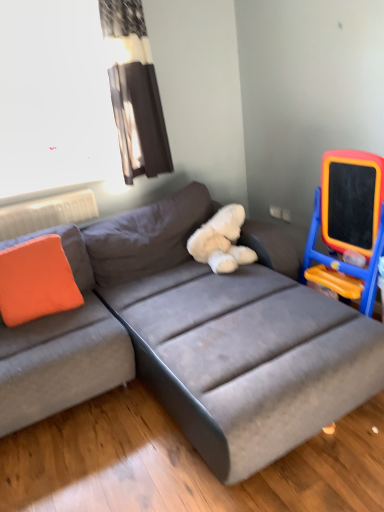
Looking at this image, measure the distance between gray fabric couch at center and camera.

gray fabric couch at center and camera are 4.84 feet apart.

The image size is (384, 512). Describe the element at coordinates (134, 90) in the screenshot. I see `black fabric curtain at upper left` at that location.

Describe the element at coordinates (221, 241) in the screenshot. The width and height of the screenshot is (384, 512). I see `white plush teddy bear at center` at that location.

Where is `gray fabric couch at center`? The image size is (384, 512). gray fabric couch at center is located at coordinates (226, 332).

Is black fabric curtain at upper left bigger than gray fabric couch at center?

Actually, black fabric curtain at upper left might be smaller than gray fabric couch at center.

Is black fabric curtain at upper left to the left or to the right of gray fabric couch at center in the image?

black fabric curtain at upper left is positioned on gray fabric couch at center's left side.

Is black fabric curtain at upper left aimed at gray fabric couch at center?

No, black fabric curtain at upper left is not oriented towards gray fabric couch at center.

From the image's perspective, is black fabric curtain at upper left below gray fabric couch at center?

Incorrect, from the image's perspective, black fabric curtain at upper left is higher than gray fabric couch at center.

Does point (6, 97) come behind point (62, 271)?

Yes, point (6, 97) is behind point (62, 271).

Which object is further away from the camera taking this photo, transparent plastic window screen at upper left or orange fabric pillow at left?

transparent plastic window screen at upper left is further away from the camera.

From a real-world perspective, who is located lower, transparent plastic window screen at upper left or orange fabric pillow at left?

orange fabric pillow at left.

From the image's perspective, is orange plastic easel at right below transparent plastic window screen at upper left?

Yes, from the image's perspective, orange plastic easel at right is below transparent plastic window screen at upper left.

From a real-world perspective, is orange plastic easel at right physically located above or below transparent plastic window screen at upper left?

In terms of real-world spatial position, orange plastic easel at right is below transparent plastic window screen at upper left.

Can you tell me how much orange plastic easel at right and transparent plastic window screen at upper left differ in facing direction?

The angle between the facing direction of orange plastic easel at right and the facing direction of transparent plastic window screen at upper left is 88 degrees.

Considering the sizes of objects orange plastic easel at right and transparent plastic window screen at upper left in the image provided, who is wider, orange plastic easel at right or transparent plastic window screen at upper left?

With larger width is orange plastic easel at right.

From the picture: Considering the relative positions of white plush teddy bear at center and transparent plastic window screen at upper left in the image provided, is white plush teddy bear at center to the right of transparent plastic window screen at upper left from the viewer's perspective?

Yes.

Which is farther from the camera, (208, 222) or (46, 140)?

The point (46, 140) is farther.

From a real-world perspective, is white plush teddy bear at center below transparent plastic window screen at upper left?

Yes, from a real-world perspective, white plush teddy bear at center is below transparent plastic window screen at upper left.

Would you say white plush teddy bear at center is outside transparent plastic window screen at upper left?

That's correct, white plush teddy bear at center is outside of transparent plastic window screen at upper left.

Locate an element on the screen. The image size is (384, 512). curtain located on the right of orange fabric pillow at left is located at coordinates (134, 90).

Between orange fabric pillow at left and black fabric curtain at upper left, which one has larger size?

black fabric curtain at upper left.

Is black fabric curtain at upper left in contact with white plush teddy bear at center?

There is a gap between black fabric curtain at upper left and white plush teddy bear at center.

How many degrees apart are the facing directions of black fabric curtain at upper left and white plush teddy bear at center?

0.486 degrees.

Does black fabric curtain at upper left have a lesser height compared to white plush teddy bear at center?

No.

Could white plush teddy bear at center be considered to be inside black fabric curtain at upper left?

No, white plush teddy bear at center is not a part of black fabric curtain at upper left.

The height and width of the screenshot is (512, 384). Identify the location of rocking chair below the white plush teddy bear at center (from the image's perspective). (348, 224).

From the image's perspective, between orange plastic easel at right and white plush teddy bear at center, which one is located above?

white plush teddy bear at center is shown above in the image.

Does point (316, 220) appear closer or farther from the camera than point (195, 242)?

Clearly, point (316, 220) is closer to the camera than point (195, 242).

Where is `curtain that is above the gray fabric couch at center (from a real-world perspective)`? curtain that is above the gray fabric couch at center (from a real-world perspective) is located at coordinates (134, 90).

Where is `window screen to the left of orange fabric pillow at left`? The image size is (384, 512). window screen to the left of orange fabric pillow at left is located at coordinates (53, 99).

Which object lies further to the anchor point gray fabric couch at center, white plush teddy bear at center or transparent plastic window screen at upper left?

transparent plastic window screen at upper left is further to gray fabric couch at center.

Looking at this image, looking at the image, which one is located further to black fabric curtain at upper left, orange plastic easel at right or transparent plastic window screen at upper left?

Based on the image, orange plastic easel at right appears to be further to black fabric curtain at upper left.

Which object lies nearer to the anchor point transparent plastic window screen at upper left, orange fabric pillow at left or black fabric curtain at upper left?

black fabric curtain at upper left.

When comparing their distances from gray fabric couch at center, does transparent plastic window screen at upper left or orange plastic easel at right seem further?

Based on the image, transparent plastic window screen at upper left appears to be further to gray fabric couch at center.

Estimate the real-world distances between objects in this image. Which object is closer to orange fabric pillow at left, white plush teddy bear at center or transparent plastic window screen at upper left?

Among the two, white plush teddy bear at center is located nearer to orange fabric pillow at left.

Based on their spatial positions, is orange fabric pillow at left or gray fabric couch at center closer to orange plastic easel at right?

The object closer to orange plastic easel at right is gray fabric couch at center.

Estimate the real-world distances between objects in this image. Which object is further from white plush teddy bear at center, orange fabric pillow at left or orange plastic easel at right?

The object further to white plush teddy bear at center is orange fabric pillow at left.

When comparing their distances from gray fabric couch at center, does transparent plastic window screen at upper left or white plush teddy bear at center seem closer?

The object closer to gray fabric couch at center is white plush teddy bear at center.

Locate an element on the screen. This screenshot has height=512, width=384. pillow situated between transparent plastic window screen at upper left and orange plastic easel at right from left to right is located at coordinates (36, 280).

Locate an element on the screen. teddy between gray fabric couch at center and black fabric curtain at upper left in the front-back direction is located at coordinates (221, 241).

Where is `teddy located between gray fabric couch at center and transparent plastic window screen at upper left in the depth direction`? This screenshot has width=384, height=512. teddy located between gray fabric couch at center and transparent plastic window screen at upper left in the depth direction is located at coordinates (221, 241).

You are a GUI agent. You are given a task and a screenshot of the screen. Output one action in this format:
    pyautogui.click(x=<x>, y=<y>)
    Task: Click on the pillow located between gray fabric couch at center and transparent plastic window screen at upper left in the depth direction
    
    Given the screenshot: What is the action you would take?
    pyautogui.click(x=36, y=280)